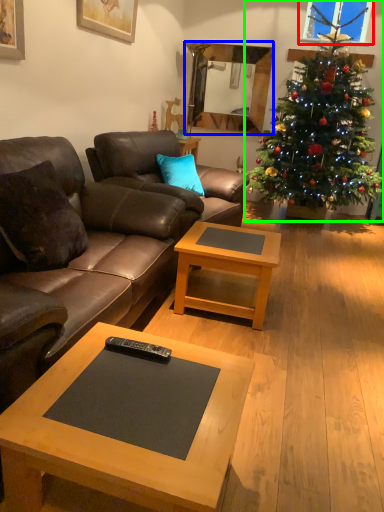
Question: Based on their relative distances, which object is nearer to window screen (highlighted by a red box)? Choose from mirror (highlighted by a blue box) and christmas tree (highlighted by a green box).

Choices:
 (A) mirror
 (B) christmas tree

Answer: (A)